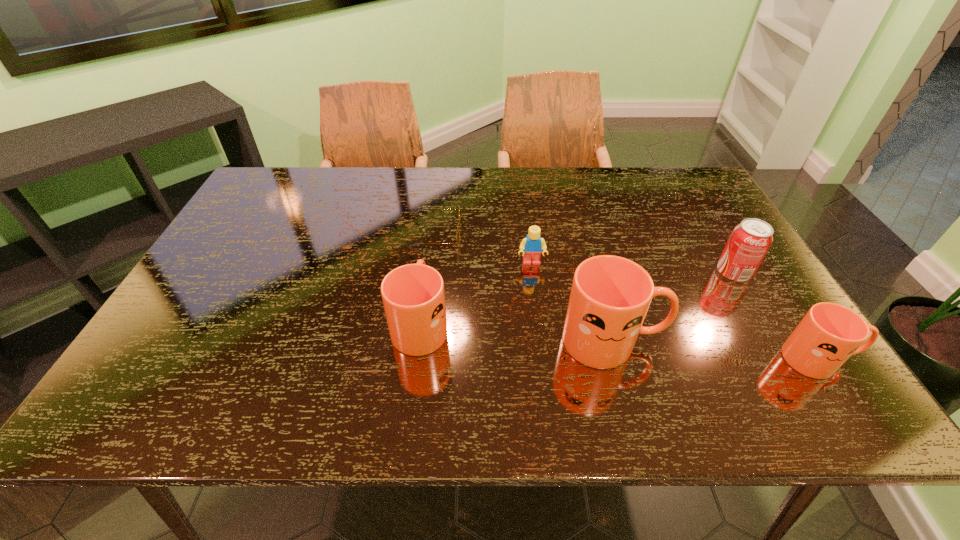
You are a GUI agent. You are given a task and a screenshot of the screen. Output one action in this format:
    pyautogui.click(x=<x>, y=<y>)
    Task: Click on the vacant point at the left edge
    The image size is (960, 540).
    Given the screenshot: What is the action you would take?
    pyautogui.click(x=223, y=300)

Where is `vacant position at the right edge of the desktop`? The height and width of the screenshot is (540, 960). vacant position at the right edge of the desktop is located at coordinates (740, 313).

In the image, there is a desktop. In order to click on vacant space at the far left corner in this screenshot , I will do `click(263, 195)`.

Find the location of a particular element. The height and width of the screenshot is (540, 960). empty space that is in between the second mug from left to right and the leftmost mug is located at coordinates (516, 332).

Locate an element on the screen. Image resolution: width=960 pixels, height=540 pixels. empty location between the soda and the shortest mug is located at coordinates (776, 316).

I want to click on vacant area that lies between the tallest mug and the second tallest mug, so click(x=516, y=332).

Locate which object ranks in proximity to the shortest mug. Please provide its 2D coordinates. Your answer should be formatted as a tuple, i.e. [(x, y)], where the tuple contains the x and y coordinates of a point satisfying the conditions above.

[(750, 240)]

Identify which object is the closest to the tallest object. Please provide its 2D coordinates. Your answer should be formatted as a tuple, i.e. [(x, y)], where the tuple contains the x and y coordinates of a point satisfying the conditions above.

[(533, 244)]

Identify which mug is located as the third nearest to the soda. Please provide its 2D coordinates. Your answer should be formatted as a tuple, i.e. [(x, y)], where the tuple contains the x and y coordinates of a point satisfying the conditions above.

[(413, 295)]

This screenshot has width=960, height=540. Identify the location of mug that stands as the second closest to the second shortest mug. (826, 337).